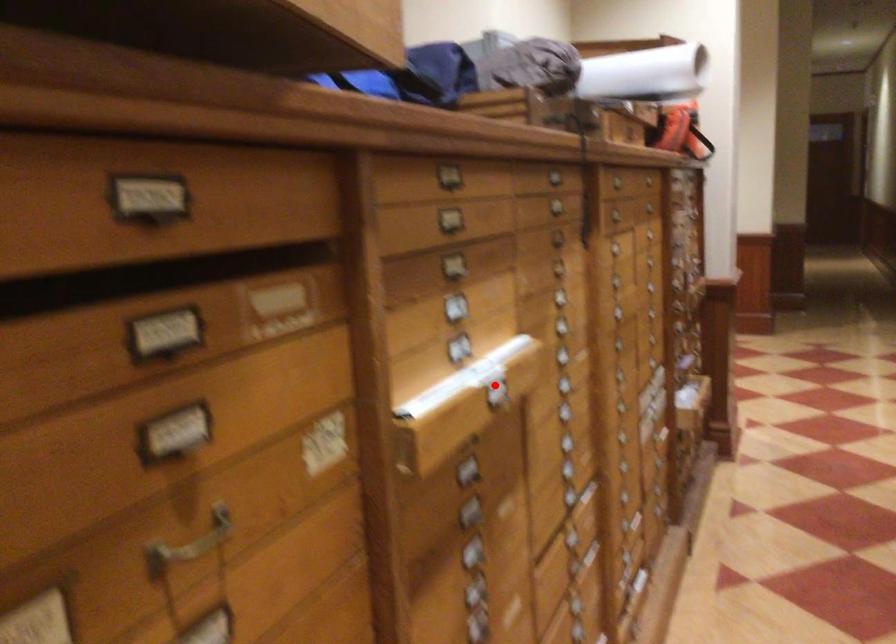
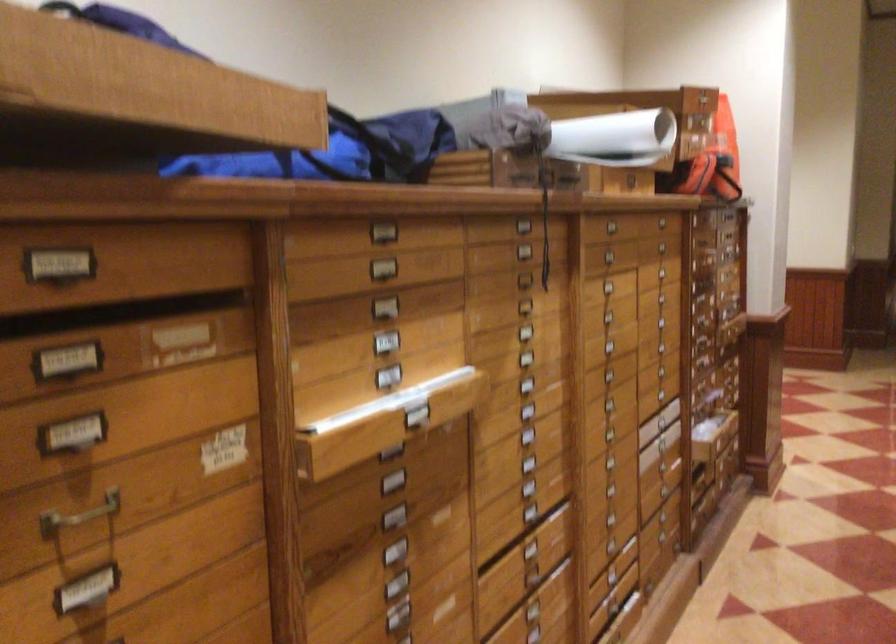
Question: I am providing you with two images of the same scene from different viewpoints. Given a red point in image1, look at the same physical point in image2. Is it:

Choices:
 (A) Closer to the viewpoint
 (B) Farther from the viewpoint

Answer: (B)